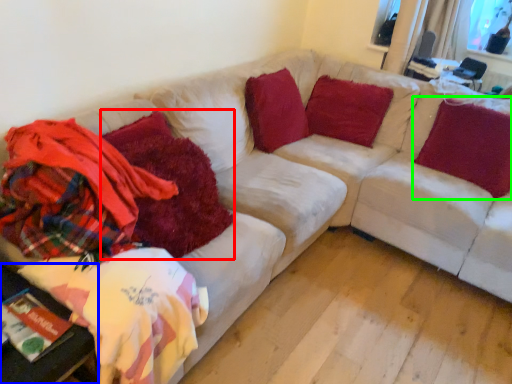
Question: Which object is positioned farthest from blanket (highlighted by a red box)? Select from table (highlighted by a blue box) and pillow (highlighted by a green box).

Choices:
 (A) table
 (B) pillow

Answer: (B)